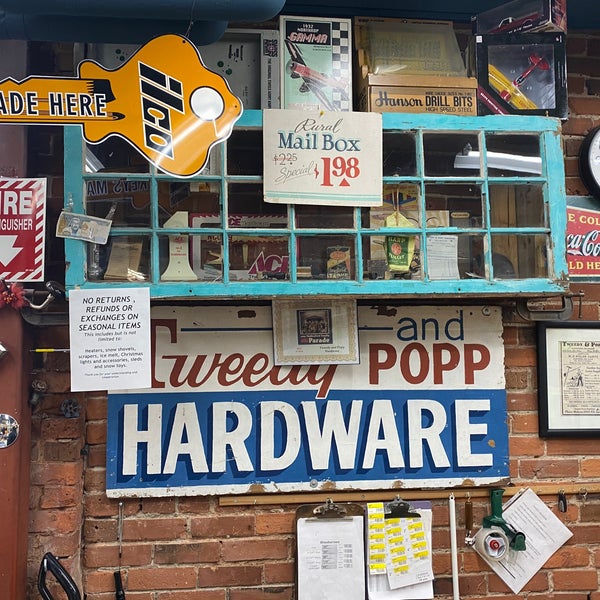
Find the location of `frame`. frame is located at coordinates (x=261, y=283), (x=403, y=122), (x=555, y=213), (x=75, y=186).